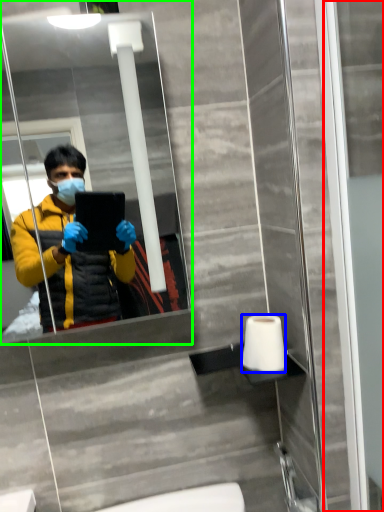
Question: Considering the real-world distances, which object is farthest from screen door (highlighted by a red box)? toilet paper (highlighted by a blue box) or mirror (highlighted by a green box)?

Choices:
 (A) toilet paper
 (B) mirror

Answer: (B)